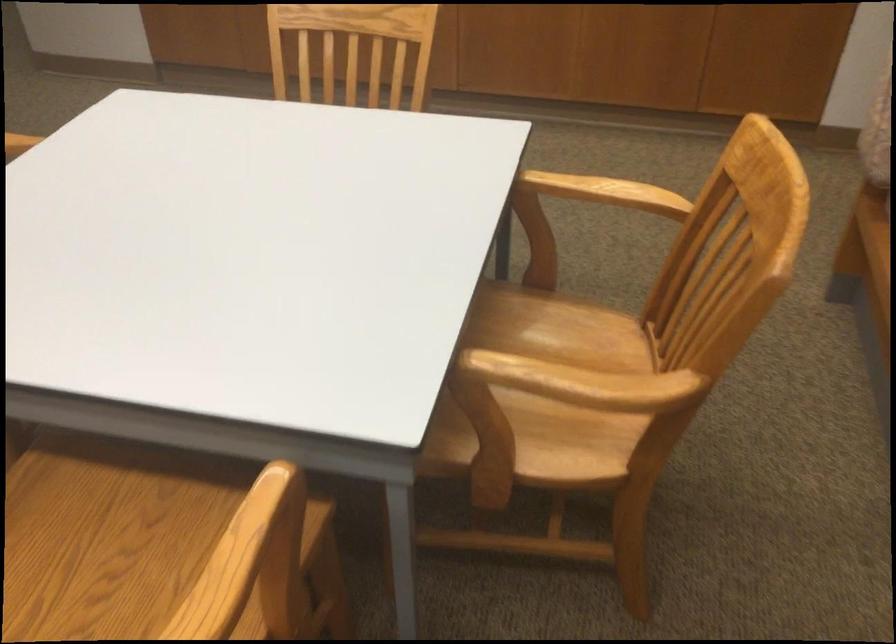
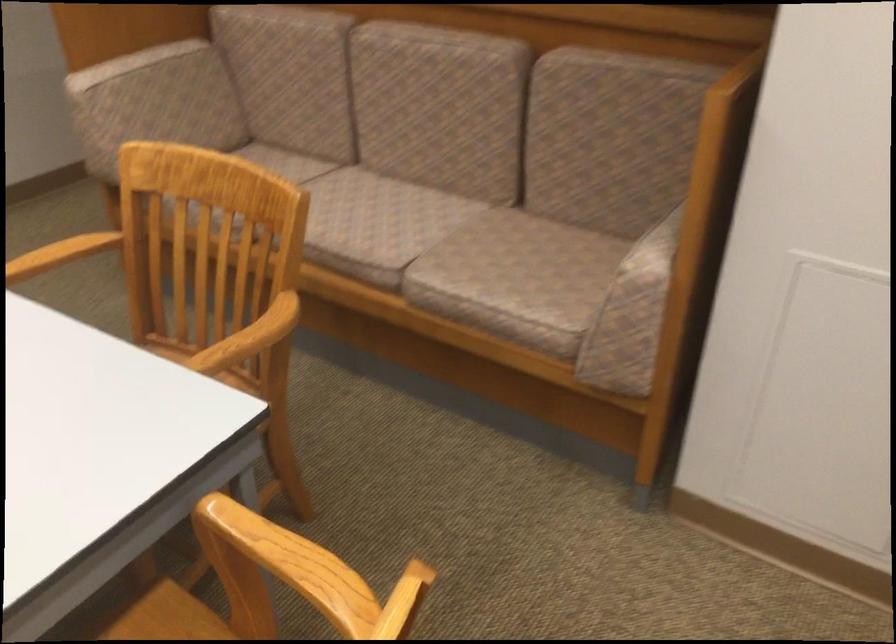
Question: I am providing you with two images of the same scene from different viewpoints. Please identify which objects are invisible in image2.

Choices:
 (A) upholstered sofa armrest
 (B) patterned trash bin
 (C) chair sitting surface
 (D) wooden chair armrest

Answer: (C)